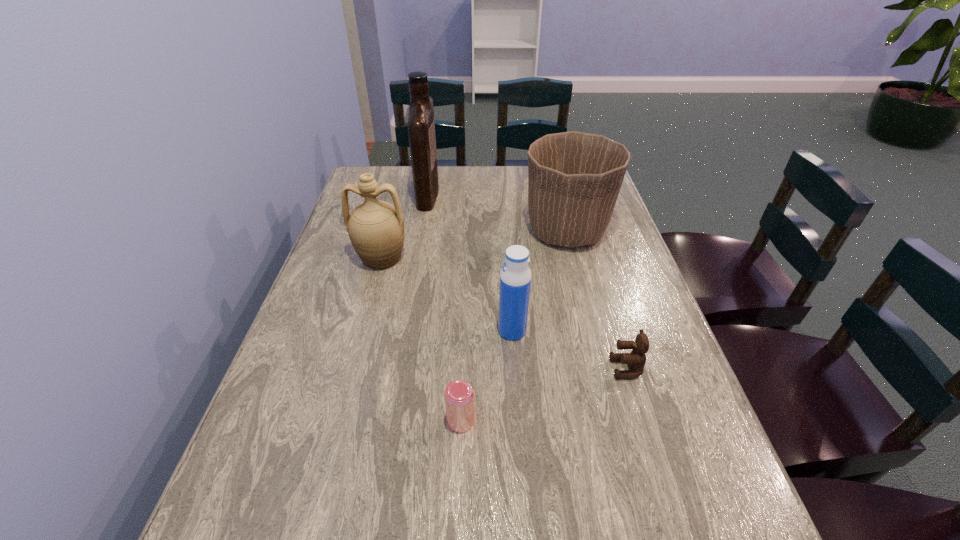
Find the location of a particular element. This screenshot has width=960, height=540. vacant space located on the right of the pitcher is located at coordinates (520, 258).

At what (x,y) coordinates should I click in order to perform the action: click on vacant area located 0.140m on the right of the water bottle. Please return your answer as a coordinate pair (x, y). Looking at the image, I should click on (588, 331).

At what (x,y) coordinates should I click in order to perform the action: click on vacant space located on the face of the teddy bear. Please return your answer as a coordinate pair (x, y). Looking at the image, I should click on (549, 368).

Where is `vacant region located on the face of the teddy bear`? The width and height of the screenshot is (960, 540). vacant region located on the face of the teddy bear is located at coordinates (448, 368).

Identify the location of vacant space located on the face of the teddy bear. This screenshot has height=540, width=960. (496, 368).

This screenshot has width=960, height=540. Find the location of `vacant space located on the left of the third object from left to right`. vacant space located on the left of the third object from left to right is located at coordinates (367, 421).

Locate an element on the screen. object located in the far edge section of the desktop is located at coordinates pos(421,127).

Find the location of a particular element. object that is at the left edge is located at coordinates (376, 228).

Locate an element on the screen. flowerpot at the right edge is located at coordinates (574, 179).

The height and width of the screenshot is (540, 960). I want to click on teddy bear that is at the right edge, so tap(636, 359).